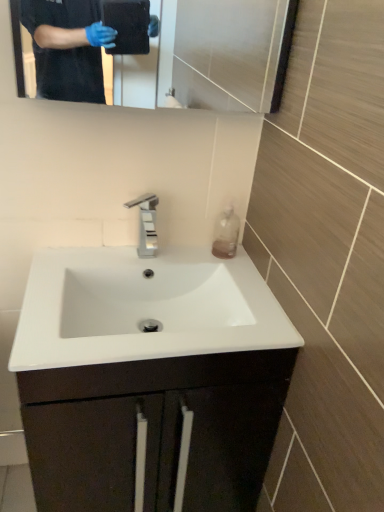
Where is `free space to the left of translucent plastic bottle at right`? free space to the left of translucent plastic bottle at right is located at coordinates (176, 255).